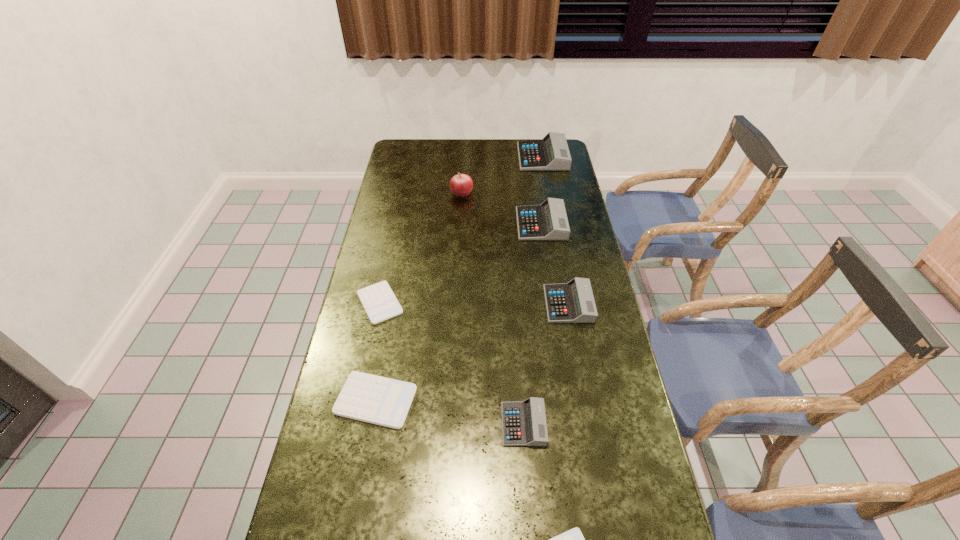
This screenshot has width=960, height=540. I want to click on free point between the tallest object and the second farthest white calculator, so click(x=419, y=296).

At what (x,y) coordinates should I click in order to perform the action: click on vacant area between the third tallest calculator and the nearest gray calculator. Please return your answer as a coordinate pair (x, y). The image size is (960, 540). Looking at the image, I should click on (546, 364).

Where is `empty location between the seventh tallest object and the third object from left to right`? The height and width of the screenshot is (540, 960). empty location between the seventh tallest object and the third object from left to right is located at coordinates (420, 248).

The width and height of the screenshot is (960, 540). I want to click on vacant area between the second farthest gray calculator and the second shortest calculator, so click(x=461, y=264).

Find the location of a particular element. This screenshot has height=540, width=960. object that can be found as the fourth closest to the fourth tallest calculator is located at coordinates (378, 300).

This screenshot has width=960, height=540. What are the coordinates of `object that stands as the closest to the farthest gray calculator` in the screenshot? It's located at (461, 185).

Choose which calculator is the fourth nearest neighbor to the apple. Please provide its 2D coordinates. Your answer should be formatted as a tuple, i.e. [(x, y)], where the tuple contains the x and y coordinates of a point satisfying the conditions above.

[(573, 302)]

Identify which calculator is the fourth closest to the sixth shortest calculator. Please provide its 2D coordinates. Your answer should be formatted as a tuple, i.e. [(x, y)], where the tuple contains the x and y coordinates of a point satisfying the conditions above.

[(365, 397)]

The width and height of the screenshot is (960, 540). I want to click on gray calculator that stands as the third closest to the third tallest calculator, so click(551, 153).

What are the coordinates of `the second closest gray calculator to the smallest gray calculator` in the screenshot? It's located at (548, 221).